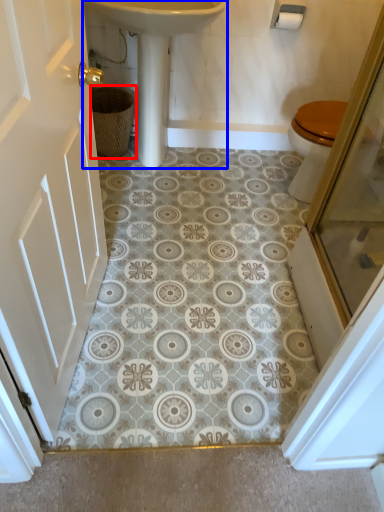
Question: Among these objects, which one is nearest to the camera, basket (highlighted by a red box) or sink (highlighted by a blue box)?

Choices:
 (A) basket
 (B) sink

Answer: (B)